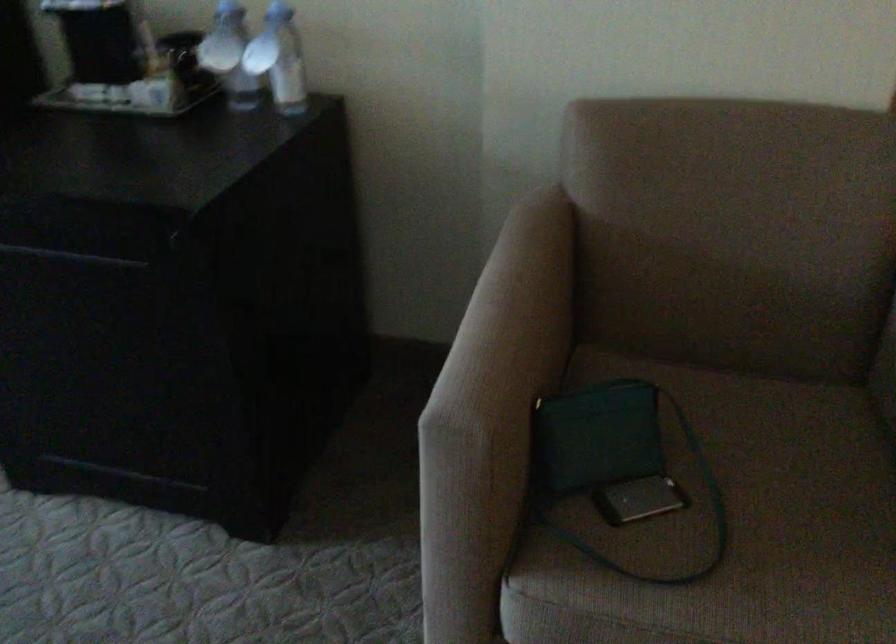
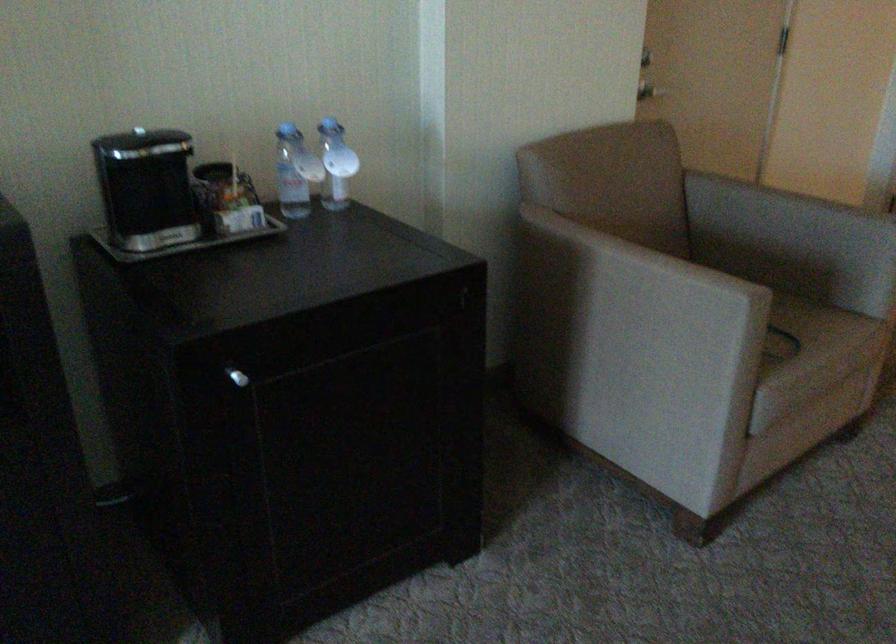
In the second image, find the point that corresponds to point (474, 341) in the first image.

(631, 283)